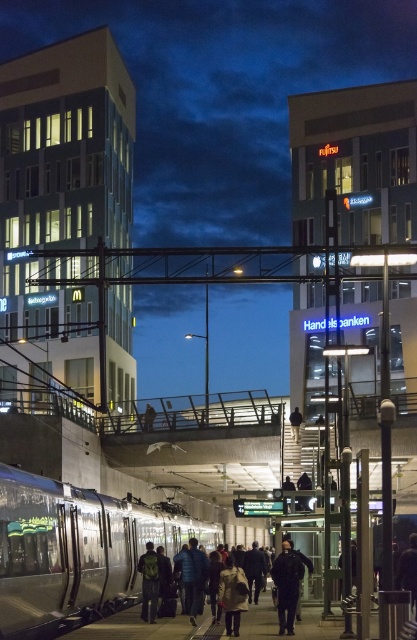
Question: Estimate the real-world distances between objects in this image. Which object is farther from the dark gray jacket at center?

Choices:
 (A) dark green backpack at center
 (B) silver metallic train at lower left

Answer: (B)

Question: Can you confirm if light beige coat at center is wider than dark green backpack at center?

Choices:
 (A) yes
 (B) no

Answer: (B)

Question: Among these objects, which one is nearest to the camera?

Choices:
 (A) dark gray jacket at center
 (B) silver metallic train at lower left
 (C) light beige coat at center
 (D) dark green backpack at center

Answer: (B)

Question: Is light beige coat at center bigger than dark green backpack at center?

Choices:
 (A) no
 (B) yes

Answer: (A)

Question: Can you confirm if dark gray jacket at center is smaller than dark green backpack at center?

Choices:
 (A) yes
 (B) no

Answer: (B)

Question: Estimate the real-world distances between objects in this image. Which object is farther from the silver metallic train at lower left?

Choices:
 (A) dark green backpack at center
 (B) dark gray jacket at center

Answer: (B)